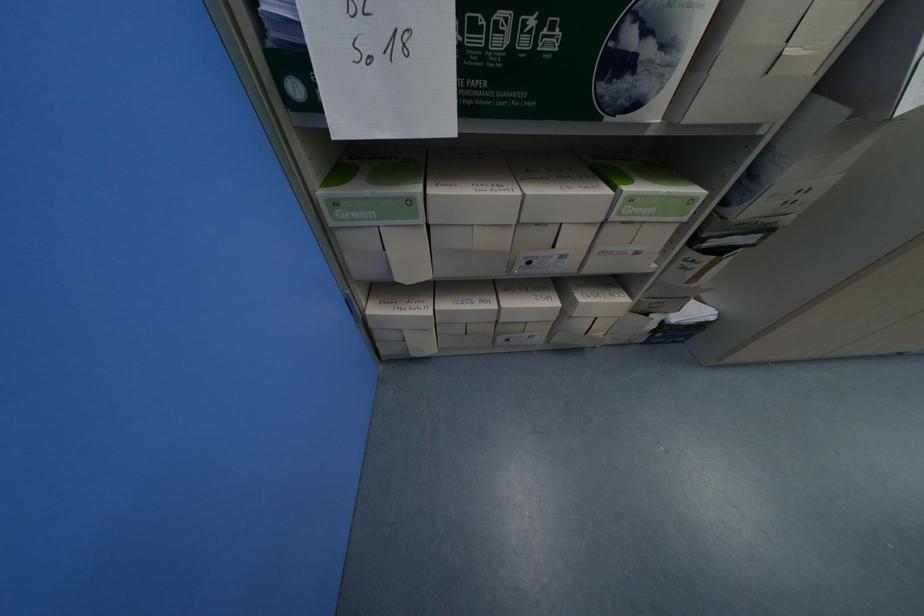
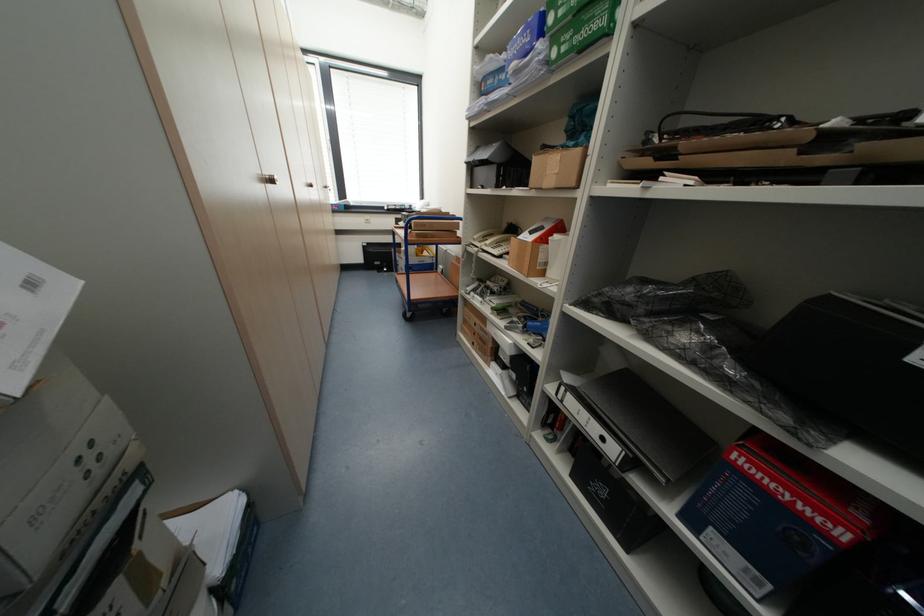
Based on the continuous images, in which direction is the camera rotating?

The camera's rotation is toward right-down.